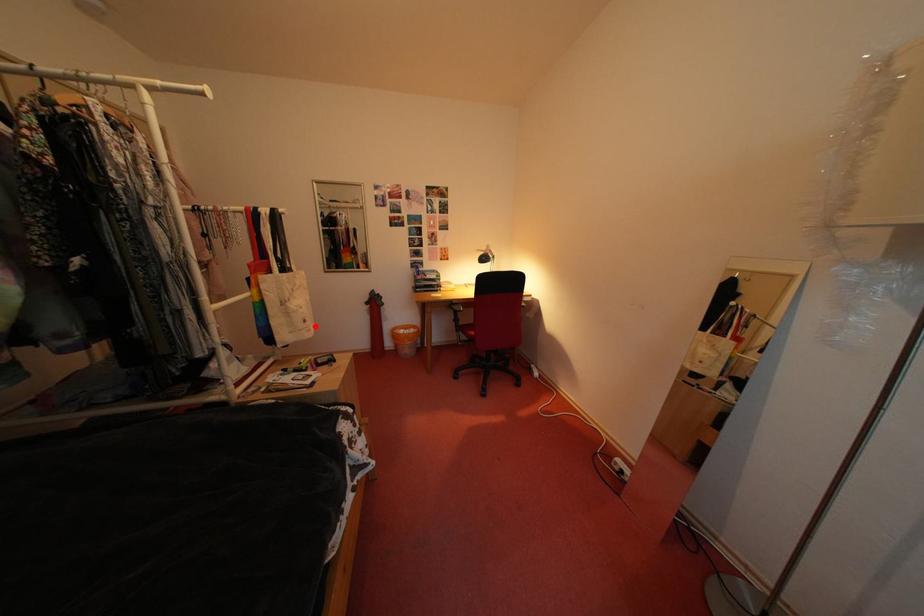
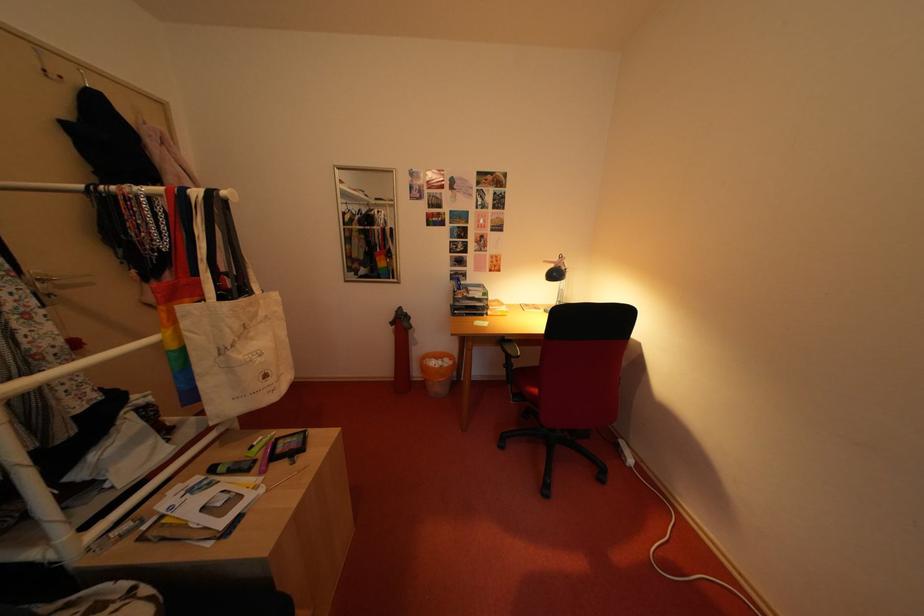
Question: I am providing you with two images of the same scene from different viewpoints. In image1, a red point is highlighted. Considering the same 3D point in image2, which of the following is correct?

Choices:
 (A) It is closer
 (B) It is farther

Answer: (B)